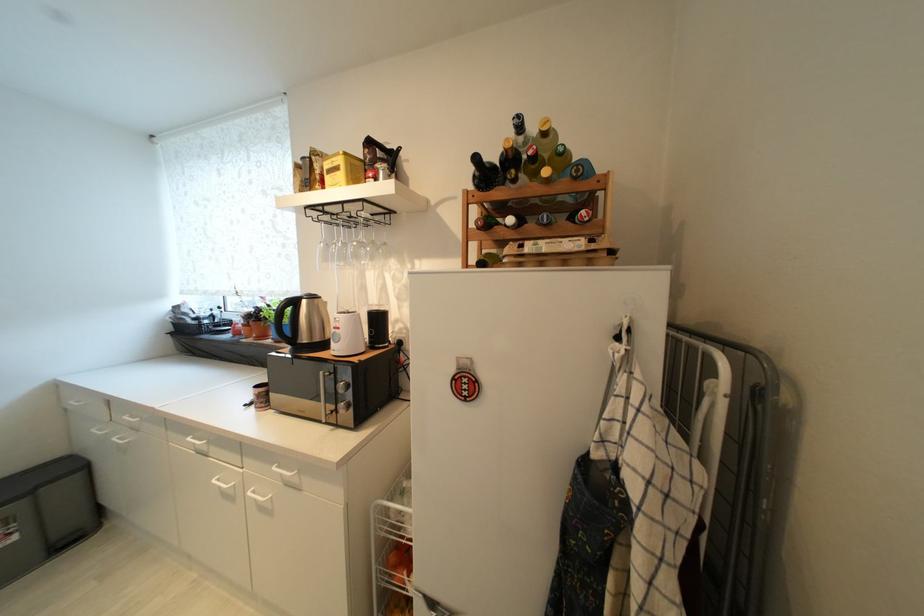
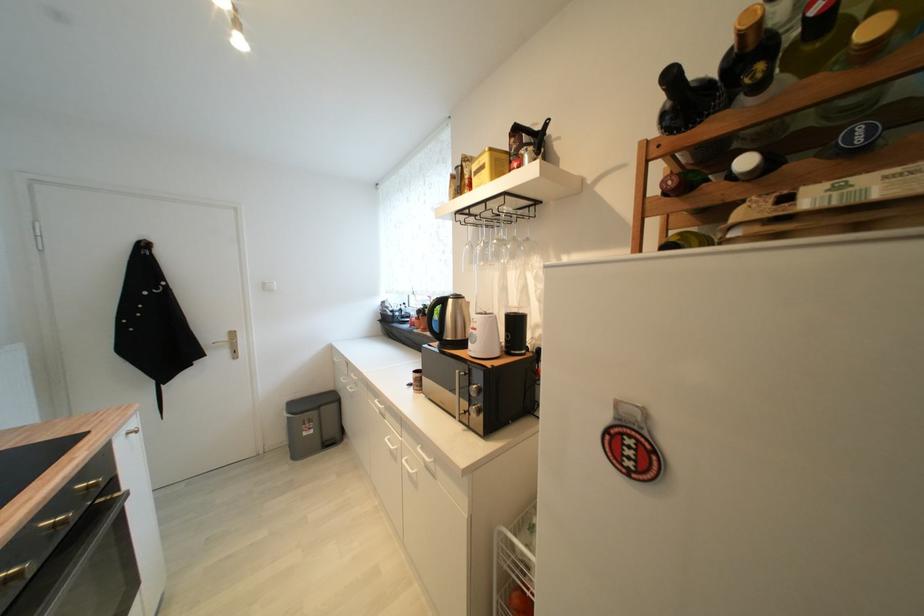
Question: Based on the continuous images, in which direction is the camera rotating? Reply with the corresponding letter.

Choices:
 (A) Left
 (B) Right
 (C) Up
 (D) Down

Answer: (A)